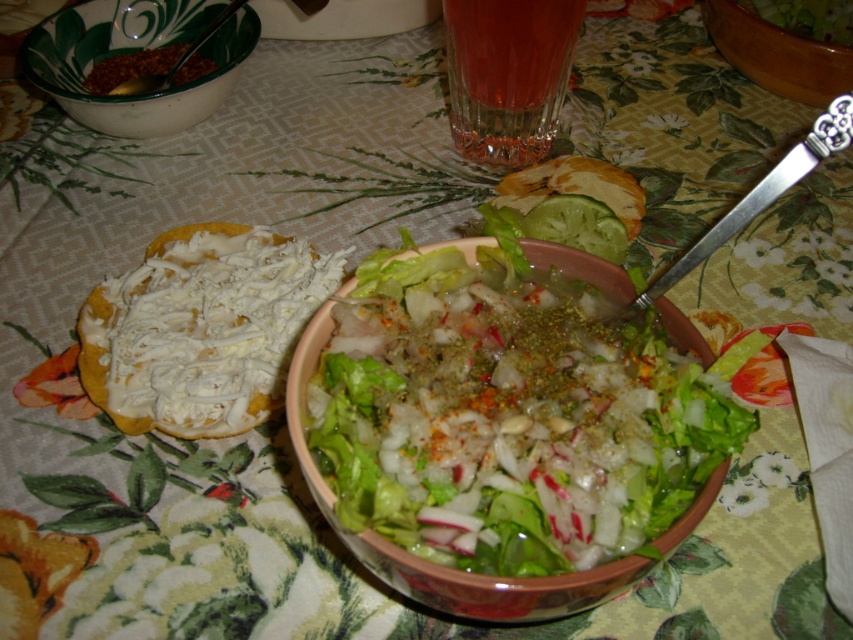
Can you confirm if fresh green salad at center is wider than translucent glass at upper center?

Yes, fresh green salad at center is wider than translucent glass at upper center.

Between fresh green salad at center and translucent glass at upper center, which one has more height?

fresh green salad at center

Between point (483, 474) and point (521, 74), which one is positioned in front?

Point (483, 474)

Locate an element on the screen. The width and height of the screenshot is (853, 640). fresh green salad at center is located at coordinates (509, 424).

Is green ceramic bowl at upper left smaller than wooden bowl at upper right?

Actually, green ceramic bowl at upper left might be larger than wooden bowl at upper right.

The image size is (853, 640). Identify the location of green ceramic bowl at upper left. (131, 51).

This screenshot has height=640, width=853. Find the location of `green ceramic bowl at upper left`. green ceramic bowl at upper left is located at coordinates pos(131,51).

Does point (451, 51) come closer to viewer compared to point (819, 93)?

Yes, point (451, 51) is in front of point (819, 93).

Between translucent glass at upper center and wooden bowl at upper right, which one is positioned higher?

Positioned higher is wooden bowl at upper right.

I want to click on translucent glass at upper center, so click(508, 74).